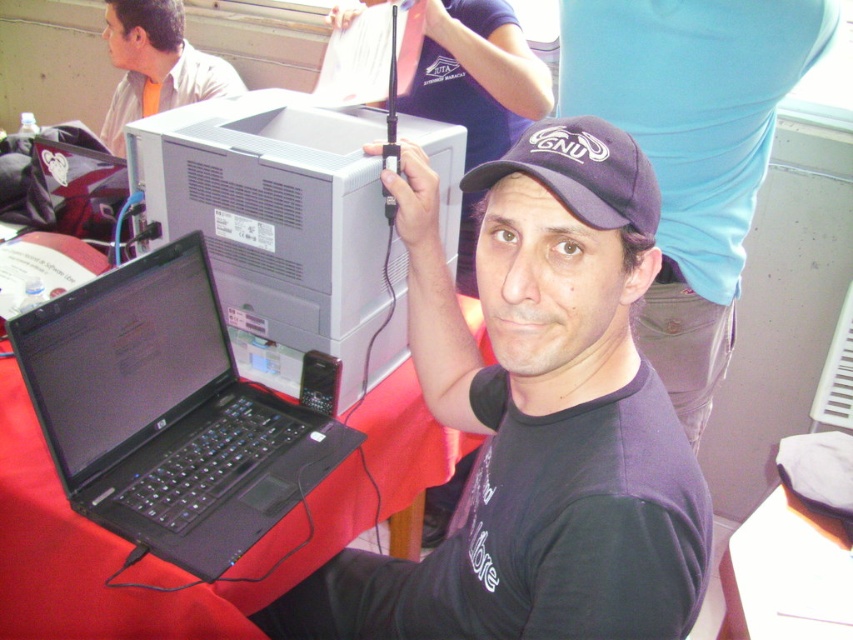
Question: Does black matte laptop at lower left have a greater width compared to dark blue fabric baseball cap at center?

Choices:
 (A) no
 (B) yes

Answer: (B)

Question: Which point is closer to the camera?

Choices:
 (A) dark blue fabric baseball cap at center
 (B) matte black cap at upper center
 (C) black matte laptop at lower left
 (D) gray matte desktop computer at upper center

Answer: (A)

Question: Can you confirm if matte black cap at upper center is positioned above dark blue fabric baseball cap at center?

Choices:
 (A) no
 (B) yes

Answer: (A)

Question: Observing the image, what is the correct spatial positioning of gray matte desktop computer at upper center in reference to light beige shirt at upper left?

Choices:
 (A) left
 (B) right

Answer: (B)

Question: Which point is closer to the camera?

Choices:
 (A) (640, 161)
 (B) (137, 20)
 (C) (189, 438)

Answer: (A)

Question: Based on their relative distances, which object is farther from the black matte laptop at lower left?

Choices:
 (A) light beige shirt at upper left
 (B) gray matte desktop computer at upper center
 (C) dark blue fabric baseball cap at center

Answer: (A)